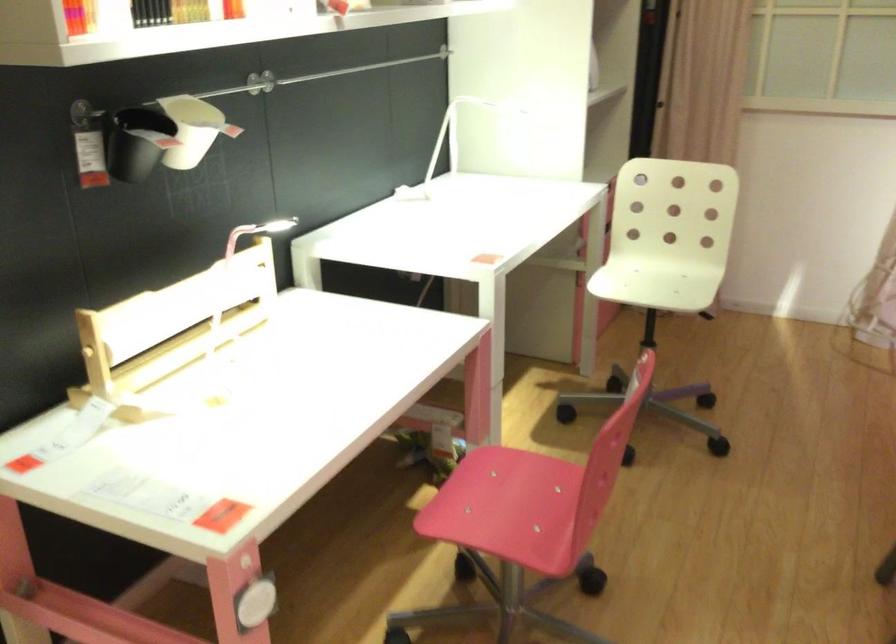
Which object does [136,142] point to?

It corresponds to the black hanging container in the image.